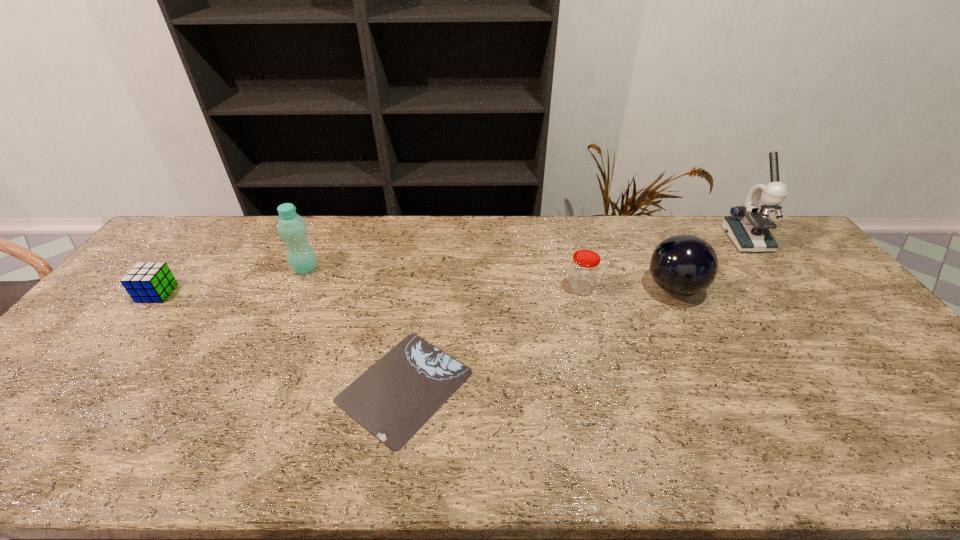
Where is `vacant area between the second object from left to right and the shortest object`? vacant area between the second object from left to right and the shortest object is located at coordinates (355, 327).

Image resolution: width=960 pixels, height=540 pixels. I want to click on free spot between the bottle and the tallest object, so click(526, 254).

The image size is (960, 540). Identify the location of unoccupied position between the mousepad and the second object from right to left. (540, 337).

I want to click on free space between the fourth object from right to left and the fifth object from right to left, so click(355, 327).

Locate an element on the screen. This screenshot has width=960, height=540. empty location between the fifth shortest object and the bowling ball is located at coordinates (490, 278).

In order to click on object that is the fourth closest to the microscope in this screenshot , I will do `click(292, 228)`.

This screenshot has width=960, height=540. I want to click on the closest object to the microscope, so click(x=683, y=265).

The width and height of the screenshot is (960, 540). I want to click on free spot that satisfies the following two spatial constraints: 1. on the front side of the leftmost object; 2. on the left side of the mousepad, so click(x=83, y=386).

I want to click on free location that satisfies the following two spatial constraints: 1. on the back side of the shortest object; 2. on the right side of the third object from right to left, so click(x=420, y=288).

I want to click on free location that satisfies the following two spatial constraints: 1. at the eyepiece of the microscope; 2. on the side of the second object from right to left with the finger holes, so click(x=784, y=288).